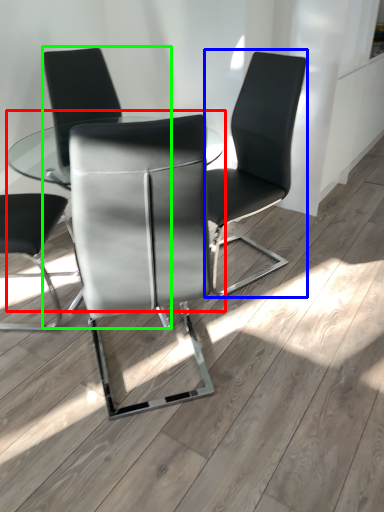
Question: Estimate the real-world distances between objects in this image. Which object is farther from table (highlighted by a red box), chair (highlighted by a blue box) or chair (highlighted by a green box)?

Choices:
 (A) chair
 (B) chair

Answer: (A)